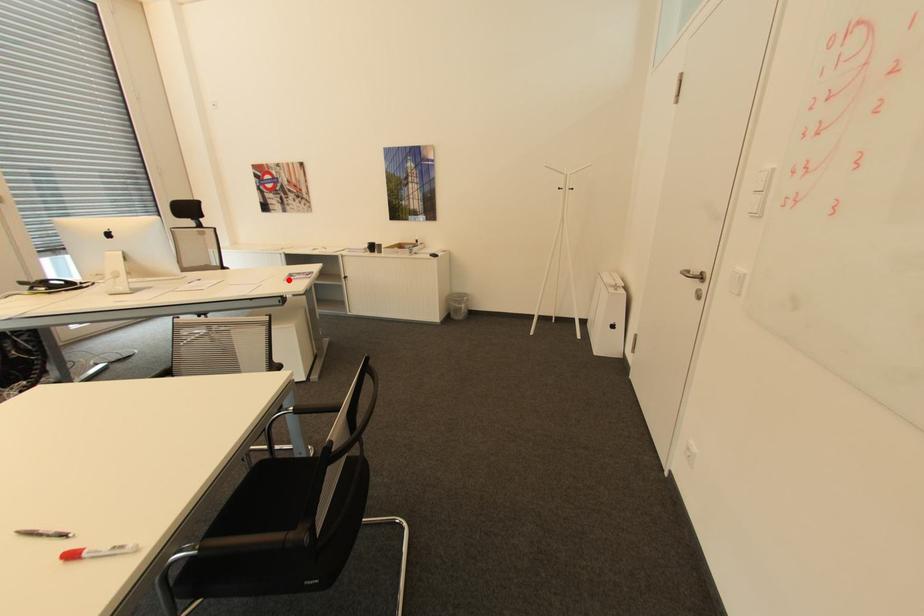
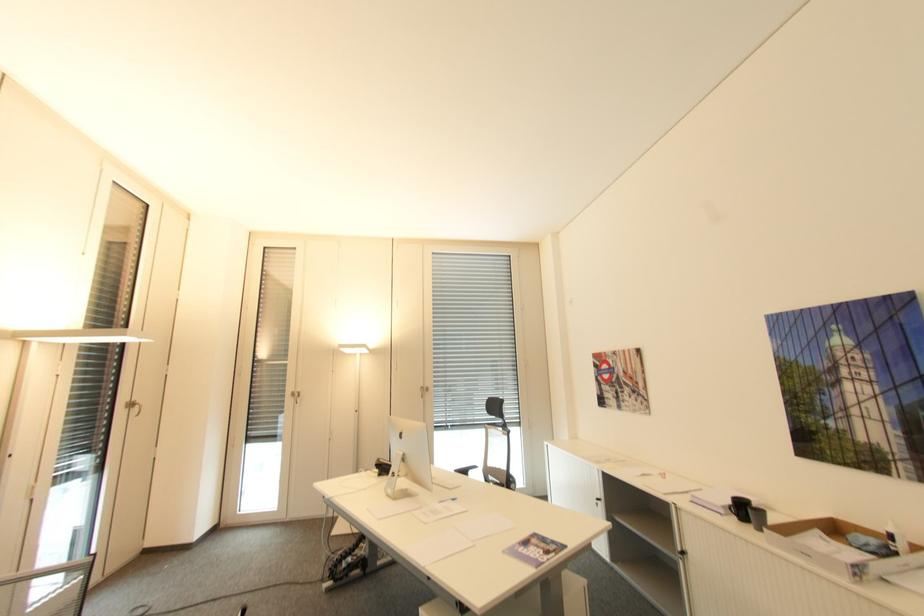
In the second image, find the point that corresponds to the highlighted location in the first image.

(507, 553)